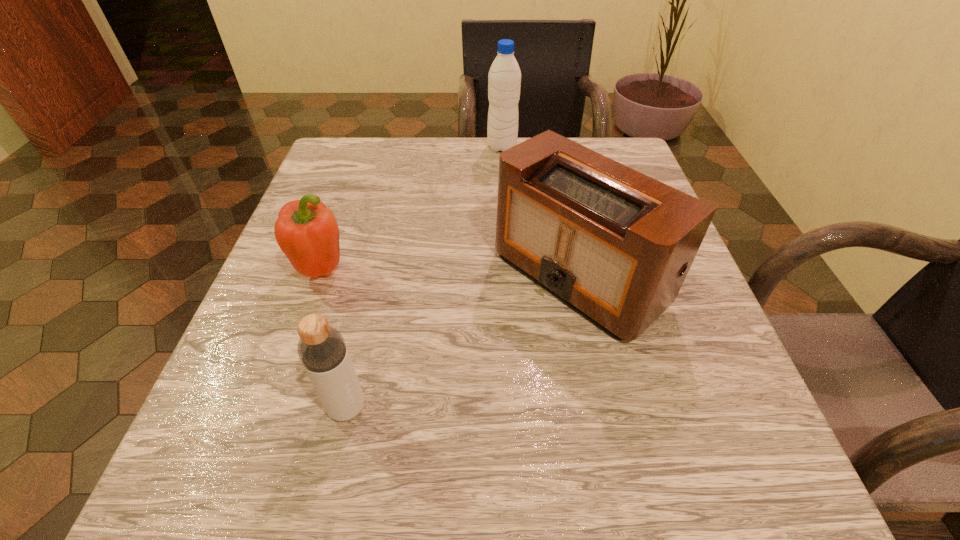
The image size is (960, 540). I want to click on object at the far edge, so click(504, 79).

Locate an element on the screen. bottle that is at the left edge is located at coordinates (321, 348).

At what (x,y) coordinates should I click in order to perform the action: click on pepper present at the left edge. Please return your answer as a coordinate pair (x, y). Looking at the image, I should click on (307, 232).

Locate an element on the screen. object that is positioned at the right edge is located at coordinates (615, 245).

In the image, there is a desktop. Where is `vacant space at the far edge`? The height and width of the screenshot is (540, 960). vacant space at the far edge is located at coordinates (464, 159).

You are a GUI agent. You are given a task and a screenshot of the screen. Output one action in this format:
    pyautogui.click(x=<x>, y=<y>)
    Task: Click on the vacant space at the near edge of the desktop
    The image size is (960, 540).
    Given the screenshot: What is the action you would take?
    pyautogui.click(x=475, y=512)

Locate an element on the screen. vacant space at the left edge of the desktop is located at coordinates (237, 415).

Image resolution: width=960 pixels, height=540 pixels. In the image, there is a desktop. Find the location of `vacant space at the near left corner`. vacant space at the near left corner is located at coordinates (284, 501).

The width and height of the screenshot is (960, 540). In the image, there is a desktop. In order to click on vacant space at the far right corner in this screenshot , I will do `click(615, 148)`.

Identify the location of vacant region at the near right corner of the desktop. This screenshot has height=540, width=960. (735, 470).